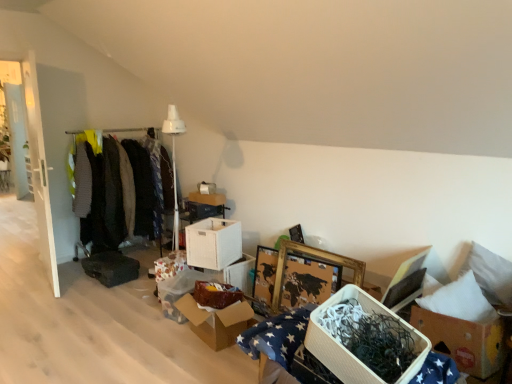
Measure the distance between white cardboard box at lower right, arranged as the 2th cardboard box when viewed from the left, and camera.

white cardboard box at lower right, arranged as the 2th cardboard box when viewed from the left, is 6.51 feet away from camera.

How much space does white cardboard box at center, which ranks as the second storage box in back-to-front order, occupy horizontally?

white cardboard box at center, which ranks as the second storage box in back-to-front order, is 5.14 inches wide.

How much space does dark green fabric at left, arranged as the first clothing when viewed from the left, occupy horizontally?

dark green fabric at left, arranged as the first clothing when viewed from the left, is 18.40 inches in width.

Where is `white cardboard box at lower right, the 2th cardboard box viewed from the back`? The width and height of the screenshot is (512, 384). white cardboard box at lower right, the 2th cardboard box viewed from the back is located at coordinates (463, 341).

Is dark green fabric at left, acting as the 3th clothing starting from the right, in contact with matte cardboard box at center, the fifth storage box when ordered from back to front?

They are not placed beside each other.

From the image's perspective, is dark green fabric at left, acting as the 3th clothing starting from the right, on matte cardboard box at center, the fifth storage box when ordered from back to front?

Yes, from the image's perspective, dark green fabric at left, acting as the 3th clothing starting from the right, is over matte cardboard box at center, the fifth storage box when ordered from back to front.

Visually, is dark green fabric at left, acting as the 3th clothing starting from the right, positioned to the left or to the right of matte cardboard box at center, the fifth storage box when ordered from back to front?

dark green fabric at left, acting as the 3th clothing starting from the right, is to the left of matte cardboard box at center, the fifth storage box when ordered from back to front.

Is matte cardboard box at center, the second storage box when ordered from front to back, surrounded by dark green fabric at left, acting as the 3th clothing starting from the right?

Actually, matte cardboard box at center, the second storage box when ordered from front to back, is outside dark green fabric at left, acting as the 3th clothing starting from the right.

Which is more to the right, knit sweater at left, which is the second clothing in right-to-left order, or dark green fabric at left, arranged as the first clothing when viewed from the left?

knit sweater at left, which is the second clothing in right-to-left order, is more to the right.

Considering the sizes of objects knit sweater at left, marked as the 2th clothing in a left-to-right arrangement, and dark green fabric at left, arranged as the first clothing when viewed from the left, in the image provided, who is bigger, knit sweater at left, marked as the 2th clothing in a left-to-right arrangement, or dark green fabric at left, arranged as the first clothing when viewed from the left,?

Bigger between the two is knit sweater at left, marked as the 2th clothing in a left-to-right arrangement.

Based on the photo, from a real-world perspective, is knit sweater at left, marked as the 2th clothing in a left-to-right arrangement, positioned over dark green fabric at left, arranged as the first clothing when viewed from the left, based on gravity?

No, from a real-world perspective, knit sweater at left, marked as the 2th clothing in a left-to-right arrangement, is not over dark green fabric at left, arranged as the first clothing when viewed from the left

Between knit sweater at left, which is the second clothing in right-to-left order, and dark green fabric at left, arranged as the first clothing when viewed from the left, which one has larger width?

With larger width is dark green fabric at left, arranged as the first clothing when viewed from the left.

Between white cardboard box at lower right, which ranks as the first cardboard box in front-to-back order, and white cardboard storage box at center, marked as the first storage box in a back-to-front arrangement, which one appears on the left side from the viewer's perspective?

white cardboard storage box at center, marked as the first storage box in a back-to-front arrangement.

Could you measure the distance between white cardboard box at lower right, which is the 1th cardboard box from right to left, and white cardboard storage box at center, marked as the first storage box in a back-to-front arrangement?

8.08 feet.

Is white cardboard box at lower right, which ranks as the first cardboard box in front-to-back order, inside the boundaries of white cardboard storage box at center, marked as the first storage box in a back-to-front arrangement, or outside?

white cardboard box at lower right, which ranks as the first cardboard box in front-to-back order, exists outside the volume of white cardboard storage box at center, marked as the first storage box in a back-to-front arrangement.

Looking at this image, is white cardboard box at lower right, arranged as the 2th cardboard box when viewed from the left, next to white cardboard storage box at center, marked as the first storage box in a back-to-front arrangement?

No, white cardboard box at lower right, arranged as the 2th cardboard box when viewed from the left, is not touching white cardboard storage box at center, marked as the first storage box in a back-to-front arrangement.

In the image, there is a cardboard box at center, which is counted as the 2th cardboard box, starting from the front. At what (x,y) coordinates should I click in order to perform the action: click on cardboard box above it (from the image's perspective). Please return your answer as a coordinate pair (x, y). The image size is (512, 384). Looking at the image, I should click on (463, 341).

From a real-world perspective, which is physically below, white cardboard box at lower right, arranged as the 2th cardboard box when viewed from the left, or cardboard box at center, which ranks as the 2th cardboard box in right-to-left order?

cardboard box at center, which ranks as the 2th cardboard box in right-to-left order, is physically lower.

Visually, is white cardboard box at lower right, which ranks as the first cardboard box in front-to-back order, positioned to the left or to the right of cardboard box at center, the 1th cardboard box viewed from the left?

From the image, it's evident that white cardboard box at lower right, which ranks as the first cardboard box in front-to-back order, is to the right of cardboard box at center, the 1th cardboard box viewed from the left.

Is white cardboard box at lower right, the 2th cardboard box viewed from the back, positioned far away from cardboard box at center, which ranks as the 2th cardboard box in right-to-left order?

Yes, white cardboard box at lower right, the 2th cardboard box viewed from the back, is far from cardboard box at center, which ranks as the 2th cardboard box in right-to-left order.

Can you tell me how much white cardboard box at center, which ranks as the second storage box in back-to-front order, and white cardboard storage box at lower right, arranged as the 1th storage box when viewed from the front, differ in facing direction?

The angular difference between white cardboard box at center, which ranks as the second storage box in back-to-front order, and white cardboard storage box at lower right, arranged as the 1th storage box when viewed from the front, is 5.51 degrees.

This screenshot has width=512, height=384. What are the coordinates of `storage box above the white cardboard storage box at lower right, arranged as the 1th storage box when viewed from the front (from a real-world perspective)` in the screenshot? It's located at (208, 198).

How much distance is there between white cardboard box at center, which ranks as the fifth storage box in front-to-back order, and white cardboard storage box at lower right, arranged as the 1th storage box when viewed from the front?

white cardboard box at center, which ranks as the fifth storage box in front-to-back order, is 7.75 feet from white cardboard storage box at lower right, arranged as the 1th storage box when viewed from the front.

Could you tell me if white cardboard box at center, which ranks as the second storage box in back-to-front order, is turned towards white cardboard storage box at lower right, which is the sixth storage box from back to front?

No.

Is cardboard box at center, which ranks as the 2th cardboard box in right-to-left order, surrounding dark green fabric at left, arranged as the first clothing when viewed from the left?

No.

Which object is closer to the camera taking this photo, cardboard box at center, which is counted as the 2th cardboard box, starting from the front, or dark green fabric at left, arranged as the first clothing when viewed from the left?

cardboard box at center, which is counted as the 2th cardboard box, starting from the front.

From the image's perspective, between cardboard box at center, the 1th cardboard box viewed from the left, and dark green fabric at left, arranged as the first clothing when viewed from the left, who is located below?

cardboard box at center, the 1th cardboard box viewed from the left, appears lower in the image.

Consider the image. Is cardboard box at center, the 1th cardboard box viewed from the left, not near dark green fabric at left, acting as the 3th clothing starting from the right?

Yes.

Is white cardboard box at center, the 3th storage box viewed from the front, to the left of dark gray fabric at left, the 3th clothing from the left, from the viewer's perspective?

Incorrect, white cardboard box at center, the 3th storage box viewed from the front, is not on the left side of dark gray fabric at left, the 3th clothing from the left.

Is point (223, 239) positioned behind point (151, 214)?

No.

Considering the sizes of objects white cardboard box at center, the 3th storage box viewed from the front, and dark gray fabric at left, the 1th clothing when ordered from right to left, in the image provided, who is bigger, white cardboard box at center, the 3th storage box viewed from the front, or dark gray fabric at left, the 1th clothing when ordered from right to left,?

→ dark gray fabric at left, the 1th clothing when ordered from right to left.

You are a GUI agent. You are given a task and a screenshot of the screen. Output one action in this format:
    pyautogui.click(x=<x>, y=<y>)
    Task: Click on the clothing that is the 2nd object located above the matte cardboard box at center, the fifth storage box when ordered from back to front (from the image's perspective)
    The image size is (512, 384).
    Given the screenshot: What is the action you would take?
    pyautogui.click(x=105, y=200)

The width and height of the screenshot is (512, 384). In order to click on clothing below the dark green fabric at left, acting as the 3th clothing starting from the right (from a real-world perspective) in this screenshot , I will do `click(149, 186)`.

Considering their positions, is white cardboard box at center, arranged as the fourth storage box when viewed from the back, positioned closer to white cardboard storage box at lower right, arranged as the 1th storage box when viewed from the front, than cardboard box at center, which is counted as the 2th cardboard box, starting from the front?

cardboard box at center, which is counted as the 2th cardboard box, starting from the front, is positioned closer to the anchor white cardboard storage box at lower right, arranged as the 1th storage box when viewed from the front.

When comparing their distances from white cardboard box at center, which ranks as the second storage box in back-to-front order, does white cardboard box at center, arranged as the fourth storage box when viewed from the back, or matte cardboard box at center, the second storage box when ordered from front to back, seem further?

The object further to white cardboard box at center, which ranks as the second storage box in back-to-front order, is matte cardboard box at center, the second storage box when ordered from front to back.

From the image, which object appears to be farther from white cardboard box at center, the 3th storage box viewed from the front, white cardboard storage box at lower right, which is the sixth storage box from back to front, or patterned fabric storage box at center, the fourth storage box from the front?

white cardboard storage box at lower right, which is the sixth storage box from back to front, lies further to white cardboard box at center, the 3th storage box viewed from the front, than the other object.

From the picture: Estimate the real-world distances between objects in this image. Which object is further from white cardboard storage box at lower right, arranged as the 1th storage box when viewed from the front, dark green fabric at left, acting as the 3th clothing starting from the right, or white cardboard storage box at center, marked as the first storage box in a back-to-front arrangement?

Based on the image, dark green fabric at left, acting as the 3th clothing starting from the right, appears to be further to white cardboard storage box at lower right, arranged as the 1th storage box when viewed from the front.

When comparing their distances from white cardboard storage box at center, marked as the first storage box in a back-to-front arrangement, does white cardboard box at center, arranged as the fourth storage box when viewed from the back, or white cardboard box at center, which ranks as the fifth storage box in front-to-back order, seem further?

Among the two, white cardboard box at center, arranged as the fourth storage box when viewed from the back, is located further to white cardboard storage box at center, marked as the first storage box in a back-to-front arrangement.

Consider the image. Looking at the image, which one is located closer to white cardboard box at center, the 3th storage box viewed from the front, patterned fabric storage box at center, the 3th storage box viewed from the back, or knit sweater at left, which is the second clothing in right-to-left order?

patterned fabric storage box at center, the 3th storage box viewed from the back, is closer to white cardboard box at center, the 3th storage box viewed from the front.

Estimate the real-world distances between objects in this image. Which object is closer to white cardboard storage box at center, positioned as the sixth storage box in front-to-back order, matte cardboard box at center, the second storage box when ordered from front to back, or dark green fabric at left, arranged as the first clothing when viewed from the left?

dark green fabric at left, arranged as the first clothing when viewed from the left, lies closer to white cardboard storage box at center, positioned as the sixth storage box in front-to-back order, than the other object.

From the image, which object appears to be farther from knit sweater at left, marked as the 2th clothing in a left-to-right arrangement, white cardboard box at center, the 3th storage box viewed from the front, or matte cardboard box at center, the second storage box when ordered from front to back?

Based on the image, matte cardboard box at center, the second storage box when ordered from front to back, appears to be further to knit sweater at left, marked as the 2th clothing in a left-to-right arrangement.

The width and height of the screenshot is (512, 384). In order to click on storage box located between knit sweater at left, which is the second clothing in right-to-left order, and matte cardboard box at center, the fifth storage box when ordered from back to front, in the left-right direction in this screenshot , I will do `click(169, 266)`.

Image resolution: width=512 pixels, height=384 pixels. I want to click on storage box between cardboard box at center, the 1th cardboard box viewed from the left, and white cardboard box at lower right, arranged as the 2th cardboard box when viewed from the left, from left to right, so click(x=347, y=349).

Find the location of `cardboard box located between dark gray fabric at left, the 3th clothing from the left, and white cardboard box at lower right, arranged as the 2th cardboard box when viewed from the left, in the left-right direction`. cardboard box located between dark gray fabric at left, the 3th clothing from the left, and white cardboard box at lower right, arranged as the 2th cardboard box when viewed from the left, in the left-right direction is located at coordinates click(x=217, y=321).

This screenshot has width=512, height=384. What are the coordinates of `cardboard box between white cardboard box at lower right, which ranks as the first cardboard box in front-to-back order, and white cardboard box at center, which ranks as the fifth storage box in front-to-back order, in the front-back direction` in the screenshot? It's located at (217, 321).